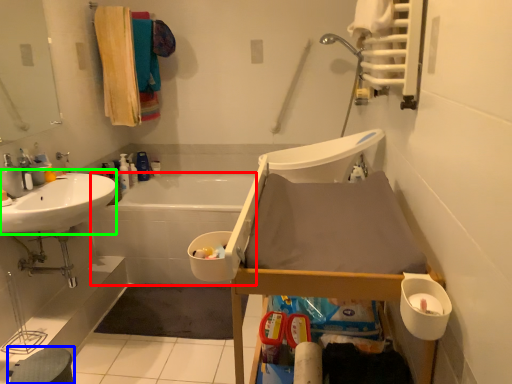
Question: Considering the real-world distances, which object is closest to bath (highlighted by a red box)? step stool (highlighted by a blue box) or sink (highlighted by a green box).

Choices:
 (A) step stool
 (B) sink

Answer: (B)